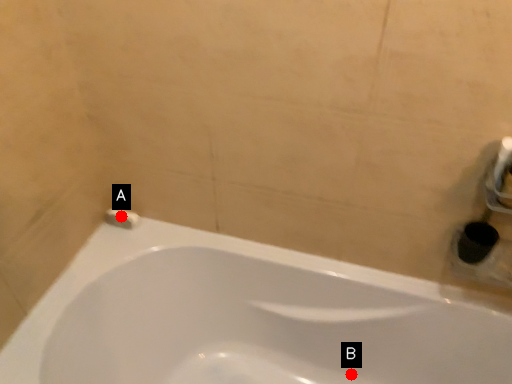
Question: Two points are circled on the image, labeled by A and B beside each circle. Which point appears farthest from the camera in this image?

Choices:
 (A) A is further
 (B) B is further

Answer: (A)